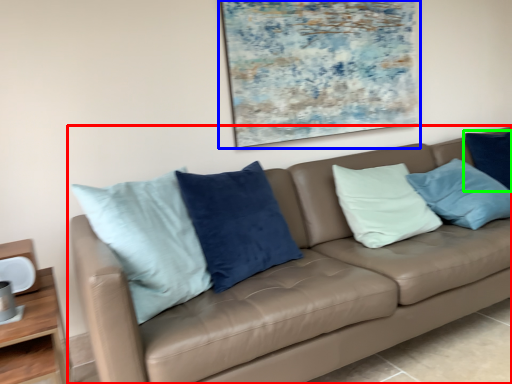
Question: Based on their relative distances, which object is farther from studio couch (highlighted by a red box)? Choose from picture frame (highlighted by a blue box) and pillow (highlighted by a green box).

Choices:
 (A) picture frame
 (B) pillow

Answer: (B)